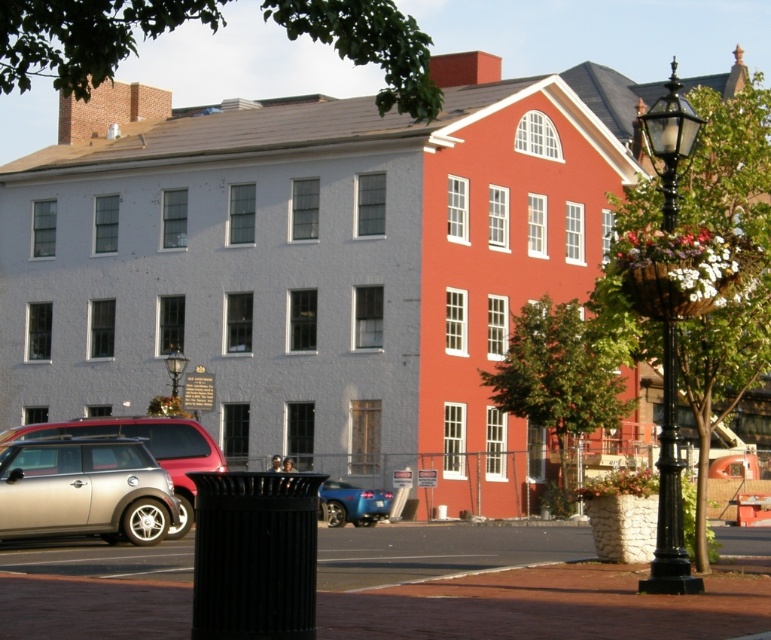
Question: Does glossy blue car at center have a lesser width compared to black glass lamp post at center?

Choices:
 (A) no
 (B) yes

Answer: (B)

Question: Which point is closer to the camera taking this photo?

Choices:
 (A) (379, 493)
 (B) (177, 362)
 (C) (19, 509)
 (D) (667, 472)

Answer: (D)

Question: Which point is farther from the camera taking this photo?

Choices:
 (A) (108, 509)
 (B) (684, 556)

Answer: (A)

Question: Does silver metallic car at lower left have a smaller size compared to black glass lamp post at center?

Choices:
 (A) no
 (B) yes

Answer: (B)

Question: Which of these objects is positioned farthest from the black metal/texture streetlamp at right?

Choices:
 (A) glossy blue car at center
 (B) silver metallic car at lower left
 (C) black glass lamp post at center

Answer: (A)

Question: Is silver metallic car at lower left positioned at the back of glossy blue car at center?

Choices:
 (A) no
 (B) yes

Answer: (A)